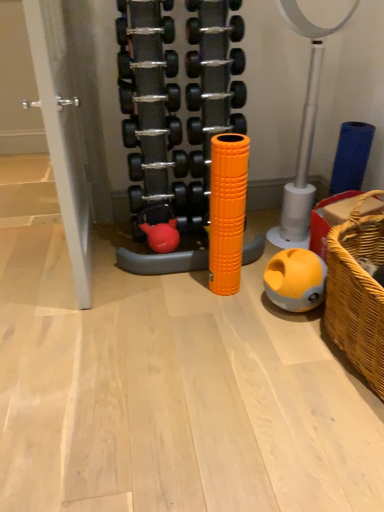
This screenshot has height=512, width=384. What are the coordinates of `free area in between woven brown basket at lower right and yellow matte ball at lower right, positioned as the third toy in top-to-bottom order` in the screenshot? It's located at (321, 356).